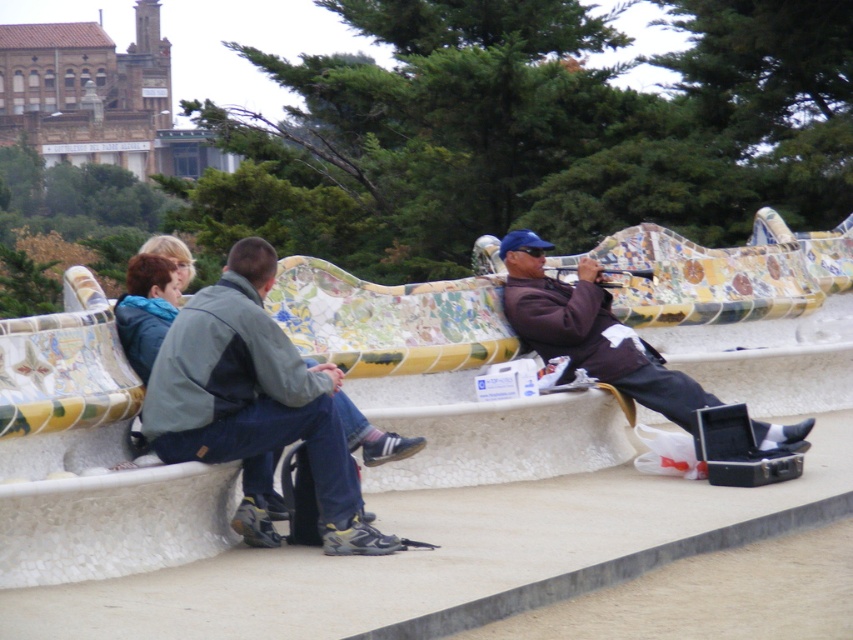
Can you confirm if matte gray jacket at center is thinner than matte brown jacket at center?

In fact, matte gray jacket at center might be wider than matte brown jacket at center.

Which is more to the left, matte gray jacket at center or matte brown jacket at center?

Positioned to the left is matte gray jacket at center.

Which is behind, point (614, 324) or point (561, 308)?

The point (614, 324) is more distant.

The width and height of the screenshot is (853, 640). Find the location of `matte gray jacket at center`. matte gray jacket at center is located at coordinates (500, 440).

Between point (271, 380) and point (518, 280), which one is positioned behind?

The point (518, 280) is behind.

Describe the element at coordinates (254, 404) in the screenshot. The image size is (853, 640). I see `gray fabric jacket at center` at that location.

I want to click on gray fabric jacket at center, so click(254, 404).

Does matte gray jacket at center appear over gray fabric jacket at center?

Indeed, matte gray jacket at center is positioned over gray fabric jacket at center.

Between matte gray jacket at center and gray fabric jacket at center, which one has less height?

gray fabric jacket at center

Is point (381, 481) positioned in front of point (172, 406)?

No, (381, 481) is further to viewer.

Identify the location of matte gray jacket at center. (500, 440).